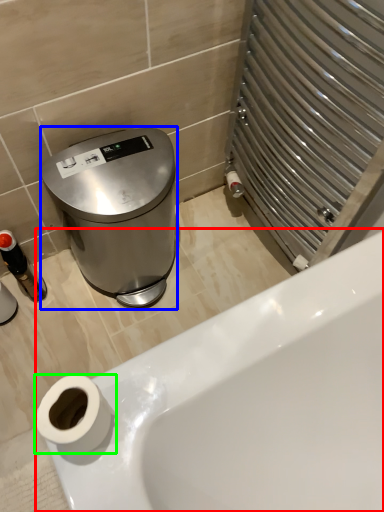
Question: Which is farther away from bathtub (highlighted by a red box)? appliance (highlighted by a blue box) or toilet paper (highlighted by a green box)?

Choices:
 (A) appliance
 (B) toilet paper

Answer: (A)